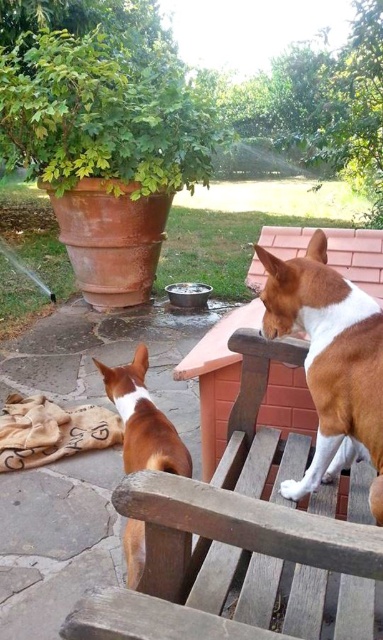
Question: Does wooden park bench at lower left have a smaller size compared to brown smooth dog at upper right?

Choices:
 (A) yes
 (B) no

Answer: (B)

Question: Where is wooden park bench at lower left located in relation to brown matte dog at lower left in the image?

Choices:
 (A) right
 (B) left

Answer: (A)

Question: Is wooden park bench at lower left to the right of brown matte dog at lower left from the viewer's perspective?

Choices:
 (A) yes
 (B) no

Answer: (A)

Question: Estimate the real-world distances between objects in this image. Which object is closer to the wooden park bench at lower left?

Choices:
 (A) brown matte dog at lower left
 (B) brown smooth dog at upper right

Answer: (B)

Question: Which object is the closest to the wooden park bench at lower left?

Choices:
 (A) brown smooth dog at upper right
 (B) brown matte dog at lower left

Answer: (A)

Question: Which point is closer to the camera taking this photo?

Choices:
 (A) (340, 454)
 (B) (144, 477)
 (C) (170, 465)

Answer: (B)